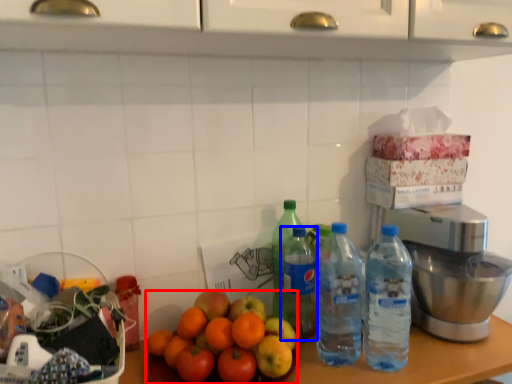
Question: Which point is closer to the camera, orange (highlighted by a red box) or bottle (highlighted by a blue box)?

Choices:
 (A) orange
 (B) bottle

Answer: (A)